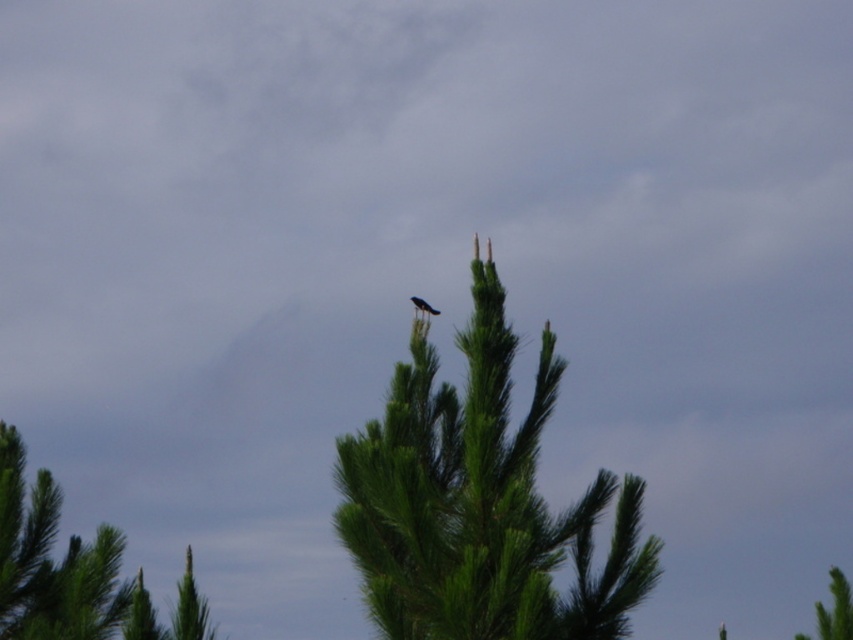
Question: Does green needle-like tree at center appear on the right side of shiny black bird at center?

Choices:
 (A) yes
 (B) no

Answer: (A)

Question: Which point is farther to the camera?

Choices:
 (A) (413, 296)
 (B) (614, 580)

Answer: (A)

Question: Is green needle-like tree at center to the right of shiny black bird at center from the viewer's perspective?

Choices:
 (A) yes
 (B) no

Answer: (A)

Question: Which point is farther from the camera taking this photo?

Choices:
 (A) (360, 449)
 (B) (425, 305)

Answer: (B)

Question: Does green needle-like tree at center appear on the right side of shiny black bird at center?

Choices:
 (A) no
 (B) yes

Answer: (B)